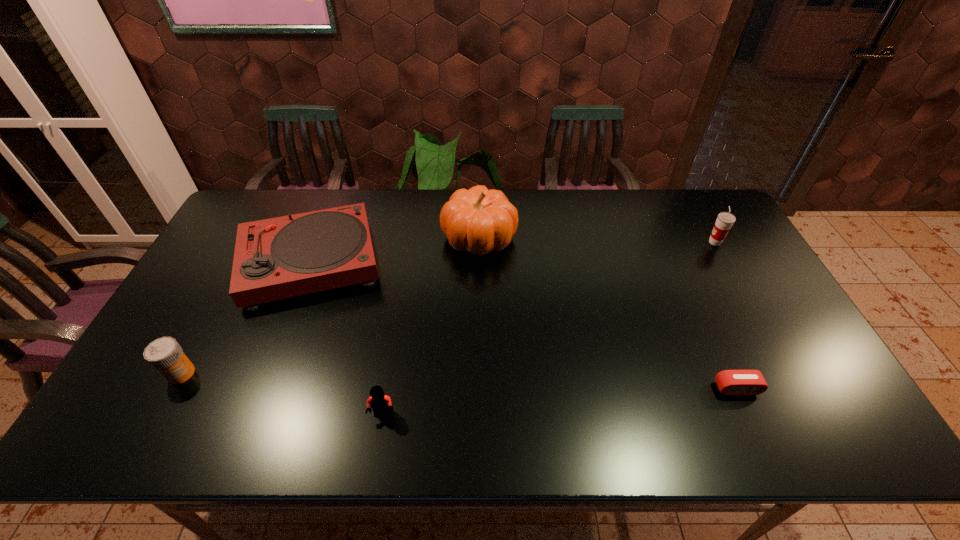
Find the location of `vacant space at the far right corner of the desktop`. vacant space at the far right corner of the desktop is located at coordinates (711, 210).

The height and width of the screenshot is (540, 960). I want to click on vacant point at the near right corner, so click(x=850, y=417).

The height and width of the screenshot is (540, 960). Find the location of `empty space that is in between the medicine and the cup`. empty space that is in between the medicine and the cup is located at coordinates (448, 308).

Identify the location of blank region between the nearest object and the pumpkin. (431, 326).

I want to click on free space that is in between the alarm clock and the tallest object, so point(608,313).

Where is `vacant area between the medicine and the Lego`? The height and width of the screenshot is (540, 960). vacant area between the medicine and the Lego is located at coordinates (282, 394).

I want to click on vacant region between the rightmost object and the alarm clock, so click(x=726, y=315).

Where is `unoccupied area between the cup and the record player`? unoccupied area between the cup and the record player is located at coordinates (513, 252).

Identify the location of vacant area that lies between the fifth shortest object and the shortest object. (726, 315).

Identify the location of free space between the third object from right to left and the medicine. This screenshot has width=960, height=540. (330, 306).